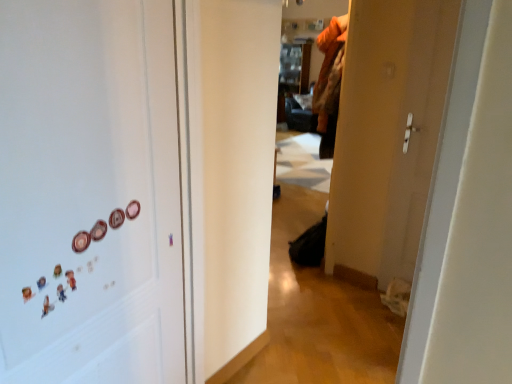
This screenshot has height=384, width=512. Describe the element at coordinates (81, 241) in the screenshot. I see `pink glossy button at left, the second button in the right-to-left sequence` at that location.

I want to click on matte plastic button at left, placed as the 1th button when sorted from right to left, so click(116, 218).

This screenshot has height=384, width=512. I want to click on pink glossy button at left, the 2th button viewed from the back, so click(81, 241).

Can you confirm if white matte magnets at left is thinner than pink glossy button at left, which is the 1th button in left-to-right order?

Incorrect, the width of white matte magnets at left is not less than that of pink glossy button at left, which is the 1th button in left-to-right order.

Is white matte magnets at left oriented towards pink glossy button at left, the first button when ordered from front to back?

Yes.

Is white matte magnets at left located outside pink glossy button at left, the second button in the right-to-left sequence?

white matte magnets at left is positioned outside pink glossy button at left, the second button in the right-to-left sequence.

Considering the sizes of objects white matte magnets at left and pink glossy button at left, which is the 1th button in left-to-right order, in the image provided, who is taller, white matte magnets at left or pink glossy button at left, which is the 1th button in left-to-right order,?

white matte magnets at left is taller.

Find the location of `door on the left of the matte plastic button at left, which is the second button in left-to-right order`. door on the left of the matte plastic button at left, which is the second button in left-to-right order is located at coordinates (89, 193).

Considering the sizes of objects white matte magnets at left and matte plastic button at left, placed as the 1th button when sorted from right to left, in the image provided, who is thinner, white matte magnets at left or matte plastic button at left, placed as the 1th button when sorted from right to left,?

With smaller width is matte plastic button at left, placed as the 1th button when sorted from right to left.

Is the depth of white matte magnets at left greater than that of matte plastic button at left, placed as the 1th button when sorted from right to left?

No, white matte magnets at left is in front of matte plastic button at left, placed as the 1th button when sorted from right to left.

What's the angular difference between white matte magnets at left and matte plastic button at left, which is the first button in back-to-front order,'s facing directions?

0.00413 degrees separate the facing orientations of white matte magnets at left and matte plastic button at left, which is the first button in back-to-front order.

From the image's perspective, who appears lower, pink glossy button at left, which is the 1th button in left-to-right order, or white matte magnets at left?

white matte magnets at left.

Between point (80, 238) and point (136, 86), which one is positioned in front?

The point (80, 238) is in front.

Who is bigger, pink glossy button at left, the second button in the right-to-left sequence, or white matte magnets at left?

white matte magnets at left.

Which object is thinner, pink glossy button at left, the second button in the right-to-left sequence, or white matte magnets at left?

With smaller width is pink glossy button at left, the second button in the right-to-left sequence.

This screenshot has height=384, width=512. I want to click on door in front of the matte plastic button at left, placed as the 1th button when sorted from right to left, so click(x=89, y=193).

How many degrees apart are the facing directions of matte plastic button at left, which is the first button in back-to-front order, and white matte magnets at left?

0.00413 degrees separate the facing orientations of matte plastic button at left, which is the first button in back-to-front order, and white matte magnets at left.

From the image's perspective, which one is positioned higher, matte plastic button at left, which is the 2th button in front-to-back order, or white matte magnets at left?

matte plastic button at left, which is the 2th button in front-to-back order, is shown above in the image.

Is point (113, 219) closer or farther from the camera than point (109, 235)?

Clearly, point (113, 219) is more distant from the camera than point (109, 235).

From a real-world perspective, who is located higher, pink glossy button at left, which is the 1th button in left-to-right order, or matte plastic button at left, placed as the 1th button when sorted from right to left?

matte plastic button at left, placed as the 1th button when sorted from right to left, from a real-world perspective.

Considering the relative sizes of pink glossy button at left, which is the 1th button in left-to-right order, and matte plastic button at left, which is the second button in left-to-right order, in the image provided, is pink glossy button at left, which is the 1th button in left-to-right order, wider than matte plastic button at left, which is the second button in left-to-right order,?

No.

Which object is positioned more to the right, pink glossy button at left, which is the 1th button in left-to-right order, or matte plastic button at left, which is the first button in back-to-front order?

From the viewer's perspective, matte plastic button at left, which is the first button in back-to-front order, appears more on the right side.

Who is more distant, matte plastic button at left, placed as the 1th button when sorted from right to left, or pink glossy button at left, the second button in the right-to-left sequence?

matte plastic button at left, placed as the 1th button when sorted from right to left, is further from the camera.

Is matte plastic button at left, which is the 2th button in front-to-back order, beside pink glossy button at left, which is the 1th button in left-to-right order?

No, matte plastic button at left, which is the 2th button in front-to-back order, is not in contact with pink glossy button at left, which is the 1th button in left-to-right order.

Is point (120, 221) positioned behind point (77, 250)?

Yes, point (120, 221) is behind point (77, 250).

Would you say pink glossy button at left, the 2th button viewed from the back, is part of matte plastic button at left, placed as the 1th button when sorted from right to left,'s contents?

Definitely not — pink glossy button at left, the 2th button viewed from the back, is not inside matte plastic button at left, placed as the 1th button when sorted from right to left.

You are a GUI agent. You are given a task and a screenshot of the screen. Output one action in this format:
    pyautogui.click(x=<x>, y=<y>)
    Task: Click on the 1st button behind the white matte magnets at left
    
    Given the screenshot: What is the action you would take?
    pyautogui.click(x=81, y=241)

Locate an element on the screen. This screenshot has height=384, width=512. door beneath the matte plastic button at left, placed as the 1th button when sorted from right to left (from a real-world perspective) is located at coordinates (89, 193).

Which object lies nearer to the anchor point matte plastic button at left, placed as the 1th button when sorted from right to left, white matte magnets at left or pink glossy button at left, the first button when ordered from front to back?

pink glossy button at left, the first button when ordered from front to back, lies closer to matte plastic button at left, placed as the 1th button when sorted from right to left, than the other object.

Which object lies further to the anchor point white matte magnets at left, matte plastic button at left, which is the 2th button in front-to-back order, or pink glossy button at left, the 2th button viewed from the back?

The object further to white matte magnets at left is pink glossy button at left, the 2th button viewed from the back.

Looking at the image, which one is located further to pink glossy button at left, the first button when ordered from front to back, matte plastic button at left, placed as the 1th button when sorted from right to left, or white matte magnets at left?

Based on the image, white matte magnets at left appears to be further to pink glossy button at left, the first button when ordered from front to back.

Estimate the real-world distances between objects in this image. Which object is further from pink glossy button at left, the first button when ordered from front to back, white matte magnets at left or matte plastic button at left, which is the first button in back-to-front order?

Based on the image, white matte magnets at left appears to be further to pink glossy button at left, the first button when ordered from front to back.

Looking at this image, when comparing their distances from white matte magnets at left, does pink glossy button at left, the first button when ordered from front to back, or matte plastic button at left, which is the first button in back-to-front order, seem closer?

Based on the image, matte plastic button at left, which is the first button in back-to-front order, appears to be nearer to white matte magnets at left.

Looking at the image, which one is located closer to matte plastic button at left, which is the 2th button in front-to-back order, pink glossy button at left, which is the 1th button in left-to-right order, or white matte magnets at left?

Based on the image, pink glossy button at left, which is the 1th button in left-to-right order, appears to be nearer to matte plastic button at left, which is the 2th button in front-to-back order.

I want to click on button positioned between white matte magnets at left and matte plastic button at left, placed as the 1th button when sorted from right to left, from near to far, so click(x=81, y=241).